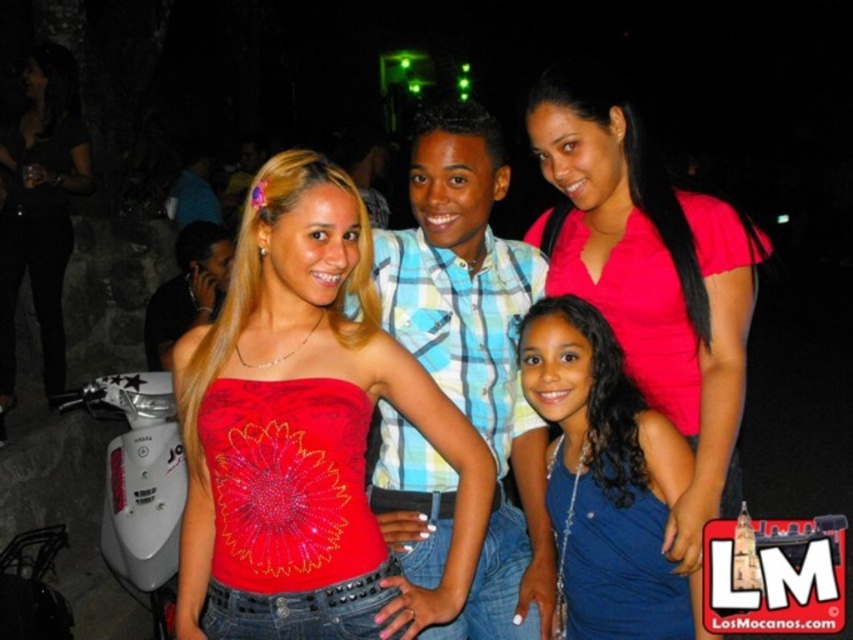
You are standing at the camera position and want to take a photo of the group. The camera has a focal length of 50mm. What is the approximate distance in meters from the camera to the point at coordinates point (x=566, y=314)?

The distance between point (x=566, y=314) and the camera is 2.30 meters.

You are a photographer at the event and want to ensure that the shiny red fabric top at center and the matte black dress at center are both visible in the photo. Based on their heights, which one might you need to adjust the camera angle to capture fully?

The shiny red fabric top at center is shorter than the matte black dress at center, so you might need to lower the camera angle to ensure the shorter shiny red fabric top at center is fully visible while still capturing the taller matte black dress at center.

You are a photographer at a party and want to take a photo of the blue satin dress at lower right and the matte black dress at center. Which dress has a narrower silhouette?

The blue satin dress at lower right has a narrower silhouette than the matte black dress at center because it is thinner.